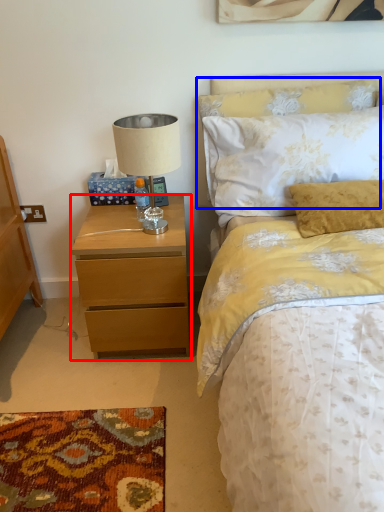
Question: Which point is closer to the camera, nightstand (highlighted by a red box) or pillow (highlighted by a blue box)?

Choices:
 (A) nightstand
 (B) pillow

Answer: (A)